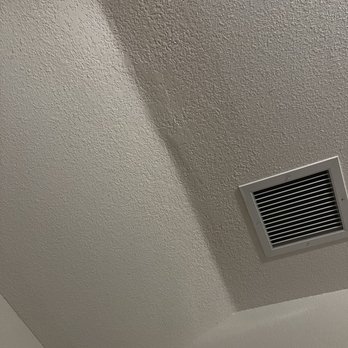
You are a GUI agent. You are given a task and a screenshot of the screen. Output one action in this format:
    pyautogui.click(x=<x>, y=<y>)
    Task: Click on the crease in ceiling
    Image resolution: width=348 pixels, height=348 pixels.
    Given the screenshot: What is the action you would take?
    pyautogui.click(x=163, y=139)